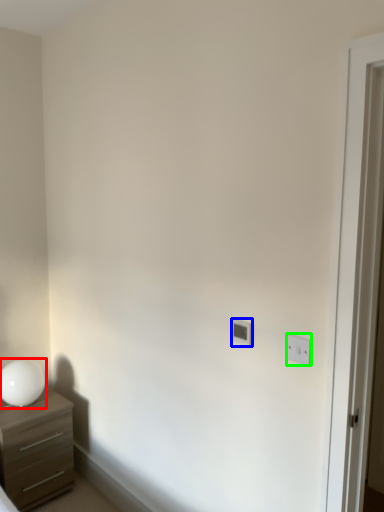
Question: Which object is positioned farthest from table lamp (highlighted by a red box)? Select from light switch (highlighted by a blue box) and light switch (highlighted by a green box).

Choices:
 (A) light switch
 (B) light switch

Answer: (B)